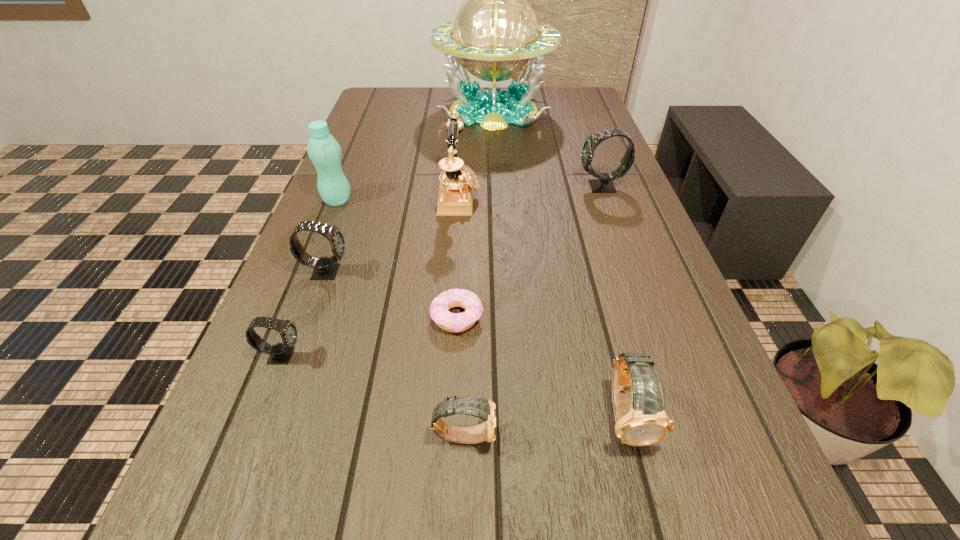
The image size is (960, 540). Identify the location of free space between the fifth farthest object and the farthest gray watch. (464, 229).

This screenshot has height=540, width=960. Find the location of `free spot between the beige telephone and the smallest gray watch`. free spot between the beige telephone and the smallest gray watch is located at coordinates (371, 276).

Where is `the eighth closest object to the right gold watch`? The width and height of the screenshot is (960, 540). the eighth closest object to the right gold watch is located at coordinates tap(495, 35).

Identify which object is located as the sixth nearest to the left gold watch. Please provide its 2D coordinates. Your answer should be formatted as a tuple, i.e. [(x, y)], where the tuple contains the x and y coordinates of a point satisfying the conditions above.

[(324, 151)]

Locate an element on the screen. This screenshot has width=960, height=540. watch that stands as the second closest to the seventh farthest object is located at coordinates (482, 408).

Locate which watch is the fourth closest to the smallest gray watch. Please provide its 2D coordinates. Your answer should be formatted as a tuple, i.e. [(x, y)], where the tuple contains the x and y coordinates of a point satisfying the conditions above.

[(604, 184)]

Locate which gray watch ranks in proximity to the bottle. Please provide its 2D coordinates. Your answer should be formatted as a tuple, i.e. [(x, y)], where the tuple contains the x and y coordinates of a point satisfying the conditions above.

[(325, 268)]

Where is `gray watch that can be found as the closest to the smallest gray watch`? The height and width of the screenshot is (540, 960). gray watch that can be found as the closest to the smallest gray watch is located at coordinates (325, 268).

Identify the location of vacant position in the image that satisfies the following two spatial constraints: 1. on the front side of the bottle; 2. on the right side of the shortest object. (289, 317).

Locate an element on the screen. free space that satisfies the following two spatial constraints: 1. on the face of the biggest gray watch; 2. on the front side of the bottle is located at coordinates (606, 200).